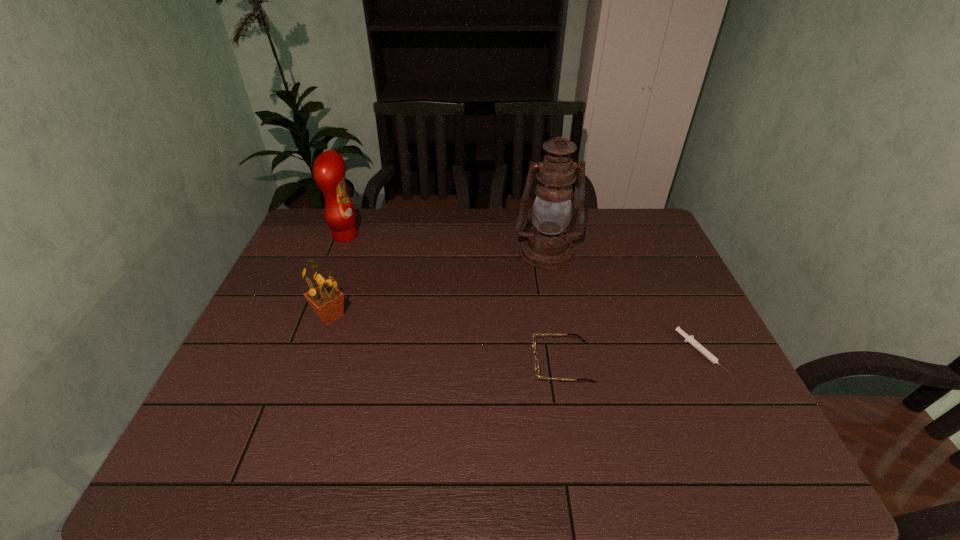
Locate an element on the screen. This screenshot has height=540, width=960. free spot between the oil lamp and the fourth tallest object is located at coordinates (555, 307).

What are the coordinates of `vacant area between the sunflower and the condiment` in the screenshot? It's located at tap(338, 275).

In order to click on vacant area between the oil lamp and the third shortest object in this screenshot , I will do `click(439, 284)`.

Find the location of `empty space between the fourth tallest object and the third nearest object`. empty space between the fourth tallest object and the third nearest object is located at coordinates (446, 339).

Identify the location of object that ranks as the closest to the condiment. (327, 301).

Identify which object is located as the fourth nearest to the fourth tallest object. Please provide its 2D coordinates. Your answer should be formatted as a tuple, i.e. [(x, y)], where the tuple contains the x and y coordinates of a point satisfying the conditions above.

[(329, 170)]

Locate an element on the screen. vacant area that satisfies the following two spatial constraints: 1. on the label side of the oil lamp; 2. on the left side of the fourth shortest object is located at coordinates (339, 252).

The height and width of the screenshot is (540, 960). I want to click on blank area in the image that satisfies the following two spatial constraints: 1. on the front side of the oil lamp; 2. on the lenses of the second shortest object, so click(x=567, y=362).

Locate an element on the screen. vacant area in the image that satisfies the following two spatial constraints: 1. on the label side of the tallest object; 2. on the left side of the condiment is located at coordinates (339, 252).

Where is `free region that satisfies the following two spatial constraints: 1. on the label side of the fourth shortest object; 2. on the back side of the tallest object`? The width and height of the screenshot is (960, 540). free region that satisfies the following two spatial constraints: 1. on the label side of the fourth shortest object; 2. on the back side of the tallest object is located at coordinates (339, 252).